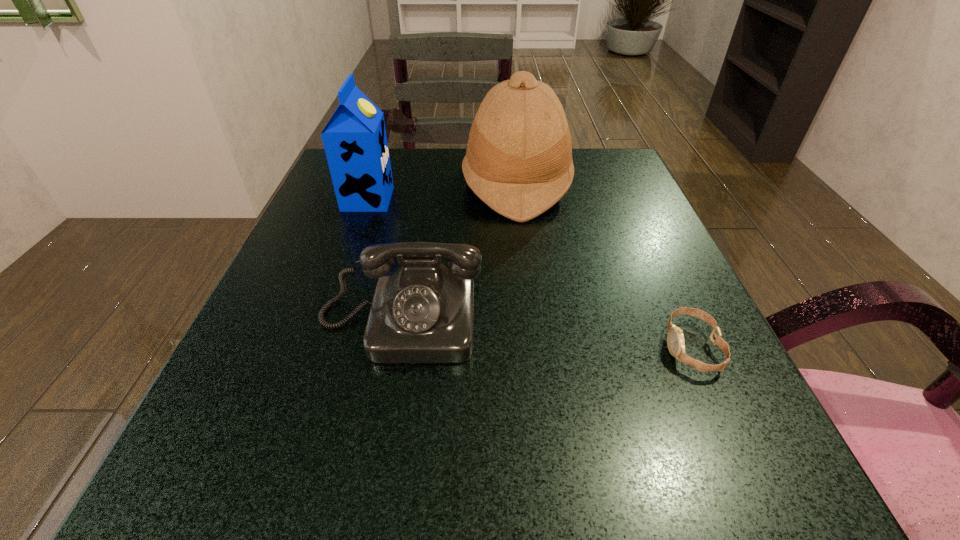
Image resolution: width=960 pixels, height=540 pixels. Find the location of `hat`. hat is located at coordinates (518, 161).

Where is `carton`? carton is located at coordinates (355, 142).

Locate an element on the screen. This screenshot has height=540, width=960. telephone is located at coordinates (423, 312).

I want to click on the shortest object, so [675, 339].

The height and width of the screenshot is (540, 960). Find the location of `watch`. watch is located at coordinates (675, 339).

Identify the location of vacant space situated on the front-facing side of the hat. This screenshot has height=540, width=960. (379, 184).

Find the location of `free space located 0.190m on the front-facing side of the hat`. free space located 0.190m on the front-facing side of the hat is located at coordinates (379, 184).

This screenshot has height=540, width=960. Identify the location of vacant region located on the front-facing side of the hat. (348, 184).

Find the location of a particular element. The height and width of the screenshot is (540, 960). vacant area situated with the cap open on the carton is located at coordinates (478, 199).

Locate an element on the screen. Image resolution: width=960 pixels, height=540 pixels. vacant space situated 0.080m on the dial of the second shortest object is located at coordinates (383, 414).